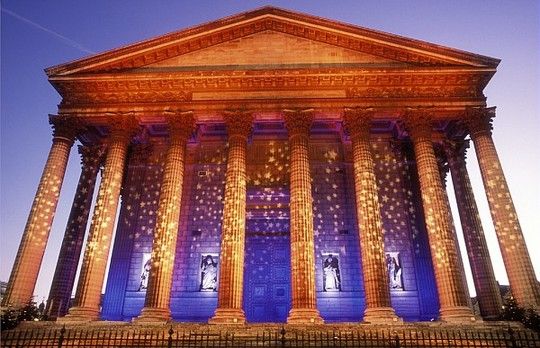
Locate an element on the screen. The width and height of the screenshot is (540, 348). statue is located at coordinates (329, 274).